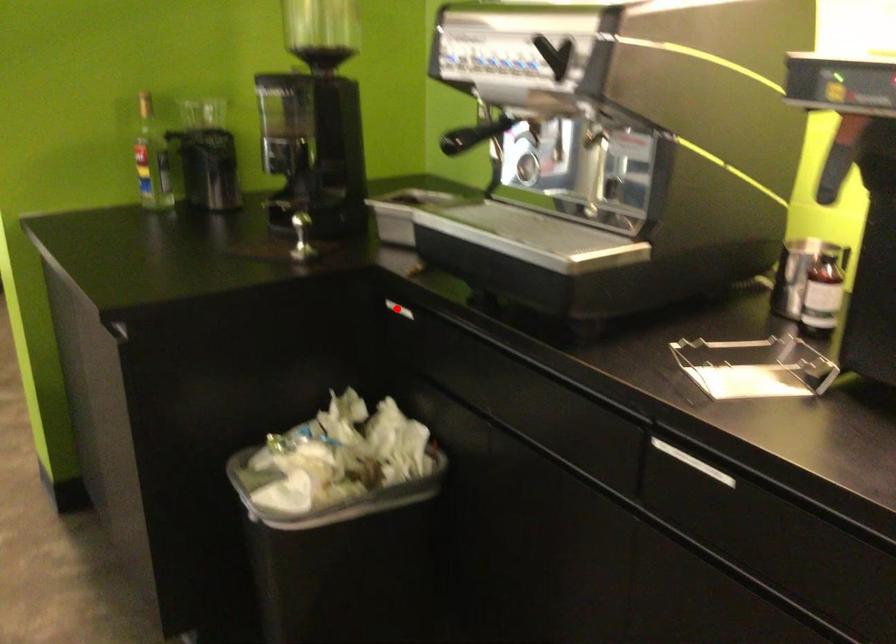
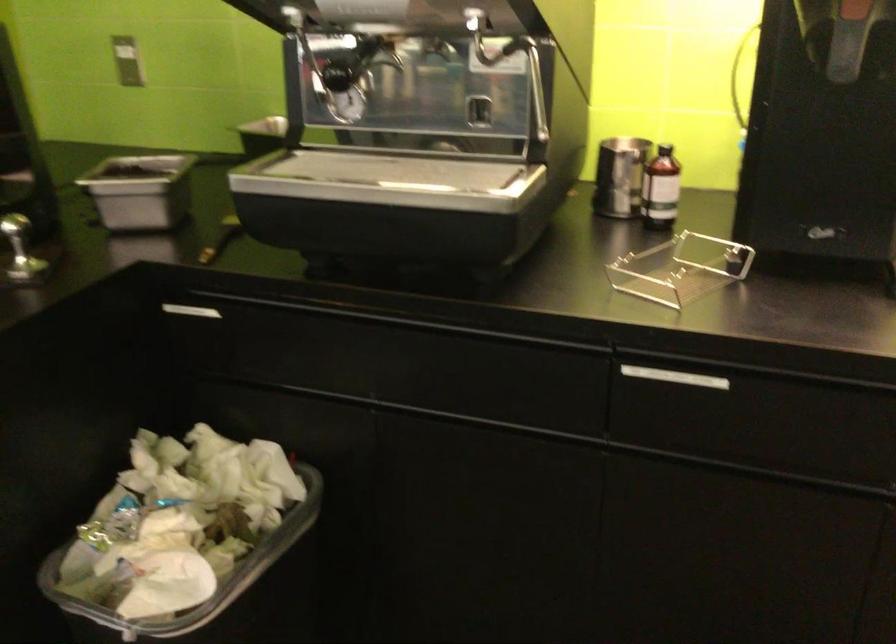
Find the pixel in the second image that matches the highlighted location in the first image.

(192, 310)